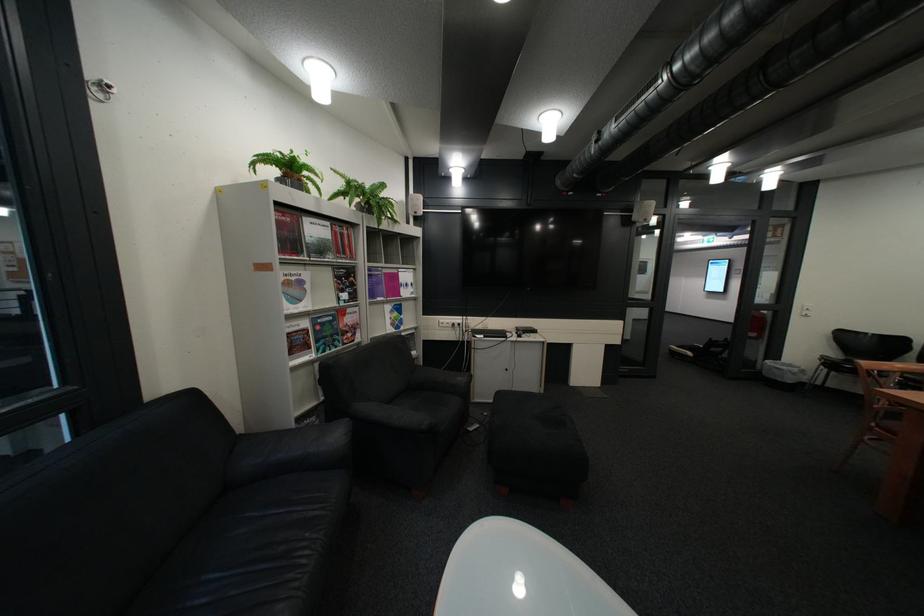
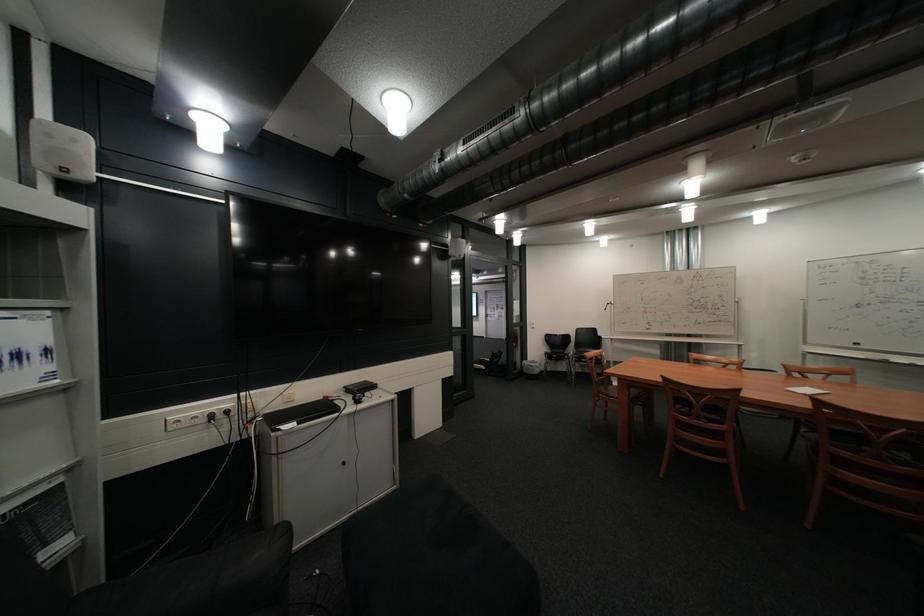
The point at (893, 429) is marked in the first image. Where is the corresponding point in the second image?

(615, 395)